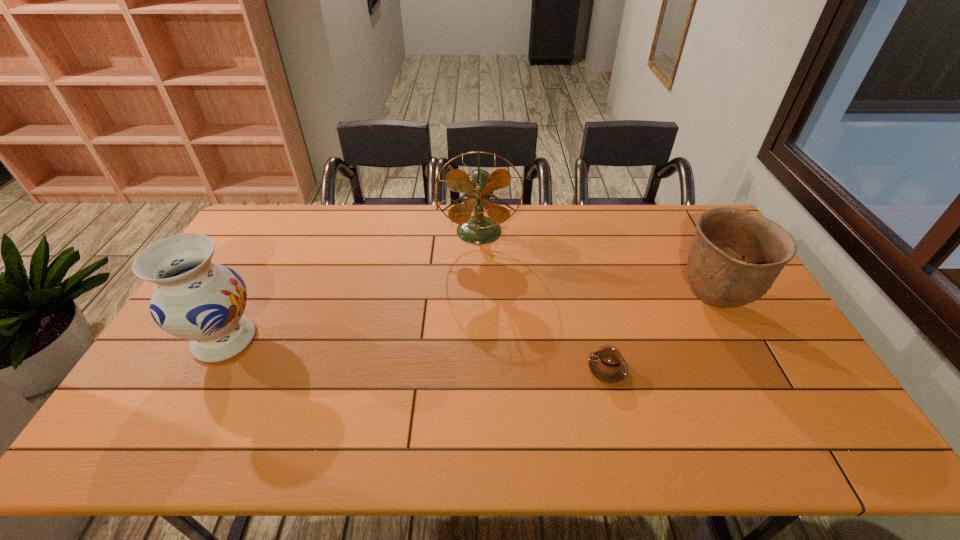
Where is `vacant space at the near right corner of the desktop`? The height and width of the screenshot is (540, 960). vacant space at the near right corner of the desktop is located at coordinates (778, 428).

The image size is (960, 540). I want to click on unoccupied area between the vase and the rightmost object, so pos(468,320).

Identify the location of free area in between the second object from left to right and the pottery. (596, 267).

I want to click on free space between the fan and the shortest object, so click(x=543, y=301).

In order to click on blank region between the farthest object and the leftmost object in this screenshot , I will do `click(351, 286)`.

In order to click on unoccupied position between the third object from right to left and the shortest object in this screenshot , I will do `click(543, 301)`.

Where is `blank region between the shortest object and the pottery`? blank region between the shortest object and the pottery is located at coordinates (660, 335).

Where is `free point between the pottery and the shortest object`? The height and width of the screenshot is (540, 960). free point between the pottery and the shortest object is located at coordinates (660, 335).

Find the location of `unoccupied area between the fan and the rightmost object`. unoccupied area between the fan and the rightmost object is located at coordinates (596, 267).

Locate an element on the screen. This screenshot has height=540, width=960. empty space that is in between the third tallest object and the vase is located at coordinates (468, 320).